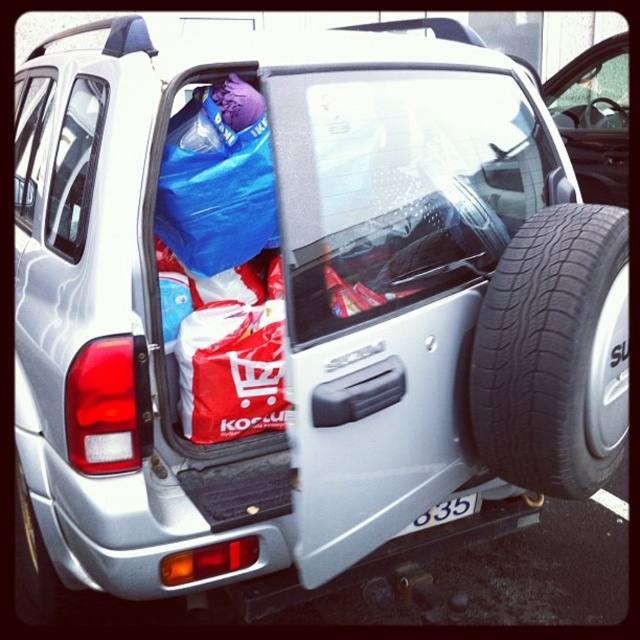
Question: Considering the real-world distances, which object is closest to the matte black car door at upper center?

Choices:
 (A) white plastic license plate at center
 (B) black rubber tire at rear

Answer: (B)

Question: Does matte black car door at upper center lie behind white plastic license plate at center?

Choices:
 (A) yes
 (B) no

Answer: (A)

Question: Does black rubber tire at rear appear on the right side of matte black car door at upper center?

Choices:
 (A) yes
 (B) no

Answer: (B)

Question: Estimate the real-world distances between objects in this image. Which object is closer to the black rubber tire at rear?

Choices:
 (A) matte black car door at upper center
 (B) white plastic license plate at center

Answer: (B)

Question: Is black rubber tire at rear bigger than matte black car door at upper center?

Choices:
 (A) yes
 (B) no

Answer: (B)

Question: Among these objects, which one is nearest to the camera?

Choices:
 (A) black rubber tire at rear
 (B) white plastic license plate at center
 (C) matte black car door at upper center

Answer: (A)